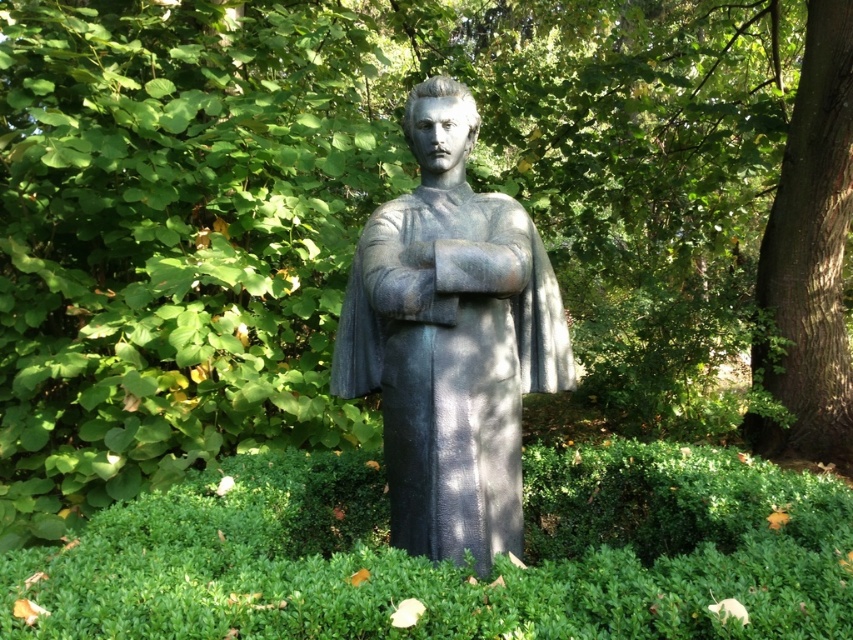
Does gray stone statue at center appear over smooth brown bark at right?

No, gray stone statue at center is not above smooth brown bark at right.

Can you confirm if gray stone statue at center is thinner than smooth brown bark at right?

No.

Is point (509, 252) farther from camera compared to point (848, 422)?

No, it is in front of (848, 422).

Where is `gray stone statue at center`? Image resolution: width=853 pixels, height=640 pixels. gray stone statue at center is located at coordinates (450, 339).